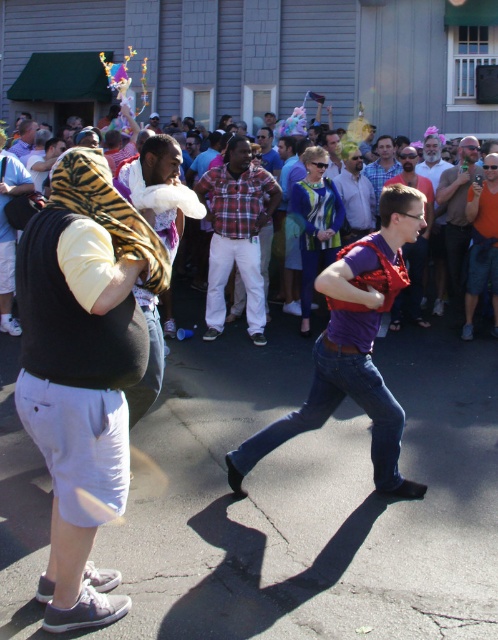
Question: Which object is the closest to the multicolored fabric at center?

Choices:
 (A) matte purple shirt at center
 (B) matte black vest at center

Answer: (A)

Question: Estimate the real-world distances between objects in this image. Which object is farther from the matte purple shirt at center?

Choices:
 (A) matte black shirt at center
 (B) orange t-shirt at right

Answer: (B)

Question: Does multicolored fabric at center lie behind matte black shirt at center?

Choices:
 (A) yes
 (B) no

Answer: (A)

Question: Is orange t-shirt at right above matte black shirt at center?

Choices:
 (A) no
 (B) yes

Answer: (A)

Question: Can you confirm if tiger-print scarf at left is positioned to the left of purple matte shirt at center?

Choices:
 (A) no
 (B) yes

Answer: (B)

Question: Among these objects, which one is farthest from the camera?

Choices:
 (A) matte black shirt at center
 (B) plaid fabric shirt at center
 (C) orange t-shirt at right

Answer: (A)